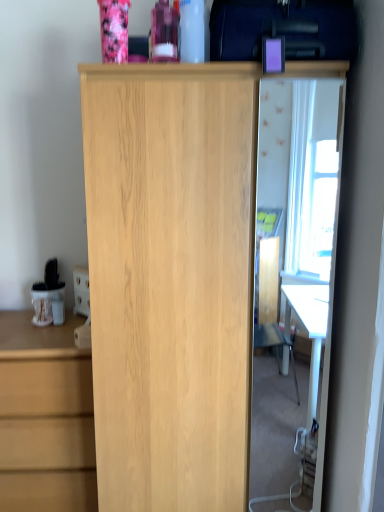
Question: From the image's perspective, is light wood chest of drawers at left positioned above or below purple plastic case at upper right?

Choices:
 (A) below
 (B) above

Answer: (A)

Question: Considering the positions of light wood chest of drawers at left and purple plastic case at upper right in the image, is light wood chest of drawers at left bigger or smaller than purple plastic case at upper right?

Choices:
 (A) small
 (B) big

Answer: (B)

Question: Considering the real-world distances, which object is closest to the purple plastic case at upper right?

Choices:
 (A) transparent glass door at center
 (B) light wood cupboard at center
 (C) light wood chest of drawers at left

Answer: (B)

Question: Estimate the real-world distances between objects in this image. Which object is farther from the light wood chest of drawers at left?

Choices:
 (A) light wood cupboard at center
 (B) transparent glass door at center
 (C) purple plastic case at upper right

Answer: (B)